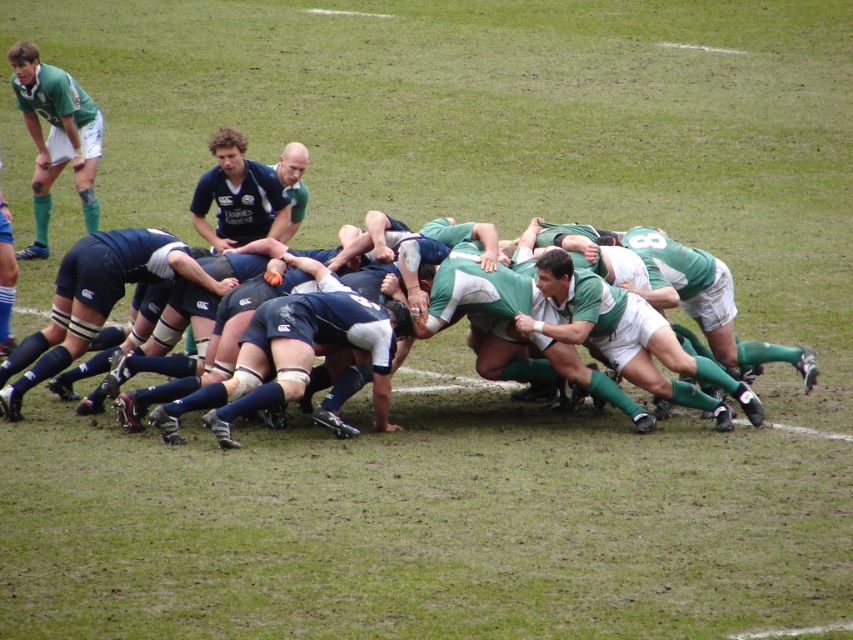
Who is higher up, dark blue jersey at center or matte green shorts at upper left?

matte green shorts at upper left is above.

Is dark blue jersey at center taller than matte green shorts at upper left?

Correct, dark blue jersey at center is much taller as matte green shorts at upper left.

What do you see at coordinates (294, 353) in the screenshot? The image size is (853, 640). I see `dark blue jersey at center` at bounding box center [294, 353].

Identify the location of dark blue jersey at center. (294, 353).

Is dark blue jersey at center positioned in front of green jersey at center?

Yes, it is in front of green jersey at center.

Is the position of dark blue jersey at center more distant than that of green jersey at center?

That is False.

Where is `dark blue jersey at center`? The height and width of the screenshot is (640, 853). dark blue jersey at center is located at coordinates (294, 353).

Is green jersey at center positioned behind matte green shorts at upper left?

No, green jersey at center is closer to the viewer.

Is green jersey at center positioned in front of matte green shorts at upper left?

Yes, it is in front of matte green shorts at upper left.

Which is in front, point (613, 291) or point (70, 120)?

Point (613, 291) is more forward.

Find the location of a particular element. This screenshot has width=853, height=640. green jersey at center is located at coordinates (628, 336).